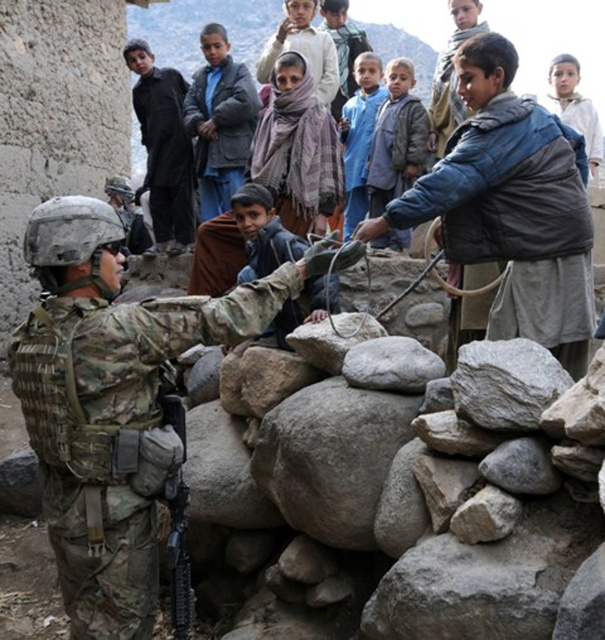
You are a drone operator trying to locate a specific object in the image. The object you need to find is the black woolen jacket at upper center. What are the coordinates of this object?

The coordinates of the black woolen jacket at upper center are at point (163, 147).

You are a photographer trying to capture a closeup of the blue fuzzy vest at center and the blue woolen sweater at upper center. Which one should you focus on first if you want to ensure both are in focus without moving the camera?

The blue fuzzy vest at center is located below the blue woolen sweater at upper center. Since they are at different vertical levels, you can focus on the one closer to the camera first. However, without knowing their distance from the camera, it is impossible to determine which one to focus on first to ensure both are in focus.